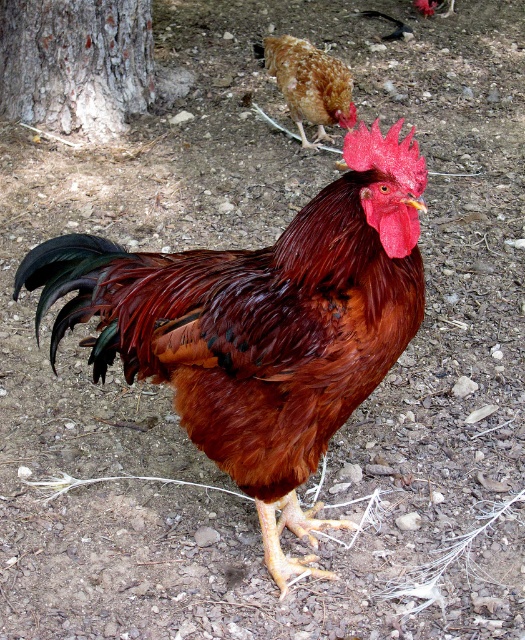
Question: Can you confirm if shiny brown rooster at center is positioned above rough bark tree at upper left?

Choices:
 (A) no
 (B) yes

Answer: (A)

Question: Among these points, which one is nearest to the camera?

Choices:
 (A) (324, 134)
 (B) (195, 380)

Answer: (B)

Question: Considering the relative positions of shiny brown rooster at center and brown speckled chicken at upper center in the image provided, where is shiny brown rooster at center located with respect to brown speckled chicken at upper center?

Choices:
 (A) above
 (B) below

Answer: (B)

Question: Among these points, which one is farthest from the camera?

Choices:
 (A) (288, 100)
 (B) (98, 10)

Answer: (B)

Question: Which object is farther from the camera taking this photo?

Choices:
 (A) shiny brown rooster at center
 (B) rough bark tree at upper left
 (C) brown speckled chicken at upper center

Answer: (B)

Question: Does shiny brown rooster at center appear on the left side of brown speckled chicken at upper center?

Choices:
 (A) no
 (B) yes

Answer: (B)